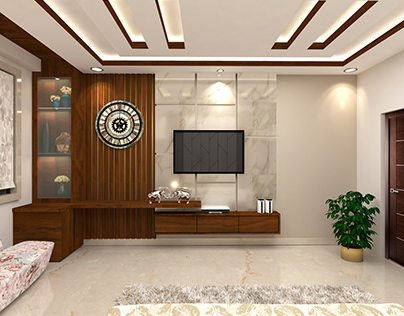
Identify the location of bouquet. (61, 178), (66, 88), (56, 97).